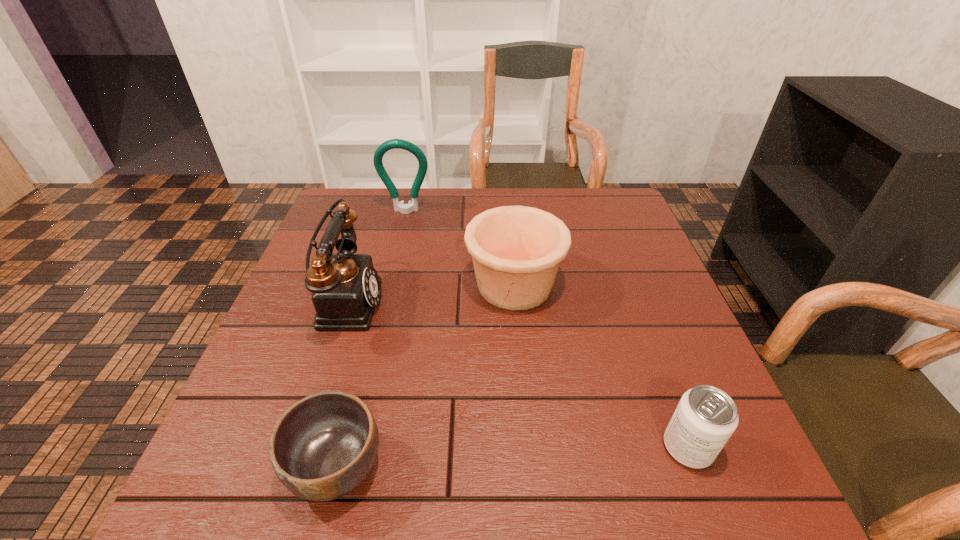
You are a GUI agent. You are given a task and a screenshot of the screen. Output one action in this format:
    pyautogui.click(x=<x>, y=<y>)
    Task: Click on the bottle opener
    The height and width of the screenshot is (540, 960).
    Given the screenshot: What is the action you would take?
    pyautogui.click(x=412, y=205)

Identify the location of telephone. (346, 286).

This screenshot has height=540, width=960. What are the coordinates of `the second object from right to left` in the screenshot? It's located at (516, 250).

You are a GUI agent. You are given a task and a screenshot of the screen. Output one action in this format:
    pyautogui.click(x=<x>, y=<y>)
    Task: Click on the third tallest object
    The width and height of the screenshot is (960, 540).
    Given the screenshot: What is the action you would take?
    pyautogui.click(x=516, y=250)

Where is `soda can`? The width and height of the screenshot is (960, 540). soda can is located at coordinates (705, 418).

Locate an element on the screen. the rightmost object is located at coordinates (705, 418).

This screenshot has height=540, width=960. Find the location of `bowl`. bowl is located at coordinates (323, 446).

The height and width of the screenshot is (540, 960). What are the coordinates of `vacant space located 0.240m at the jaws of the bottle opener` in the screenshot? It's located at (393, 269).

Identify the location of free spot located on the front of the telephone at the rotary dial. The image size is (960, 540). (424, 301).

This screenshot has width=960, height=540. In order to click on free location located 0.240m on the right of the fourth object from left to right in this screenshot , I will do (x=660, y=285).